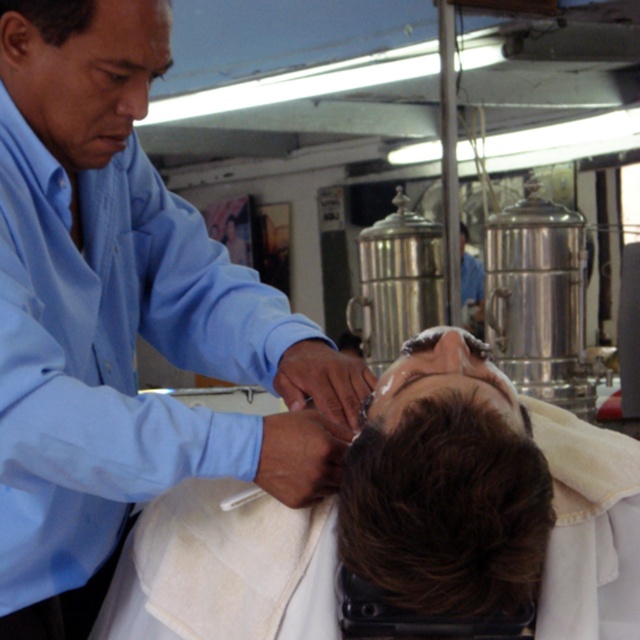
You are a customer in the barbershop and need to locate two specific points marked in the image. The first point is at coordinates point (x=586, y=440) and the second is at point (x=104, y=74). Which of these two points is positioned further back from your viewpoint?

Point (x=586, y=440) is behind point (x=104, y=74), so it is positioned further back from your viewpoint.

You are a customer in the barbershop and want to know which part of your body is larger between the smooth skin head at center and the brown matte hair at center. Can you tell me?

The smooth skin head at center is bigger than brown matte hair at center.

From the picture: You are a customer in a barbershop. You see the brown matte hair at center and the blue shirt at upper left. Which object is located more to the right side of the scene?

The brown matte hair at center is positioned on the right side of the blue shirt at upper left, so the brown matte hair at center is more to the right side of the scene.